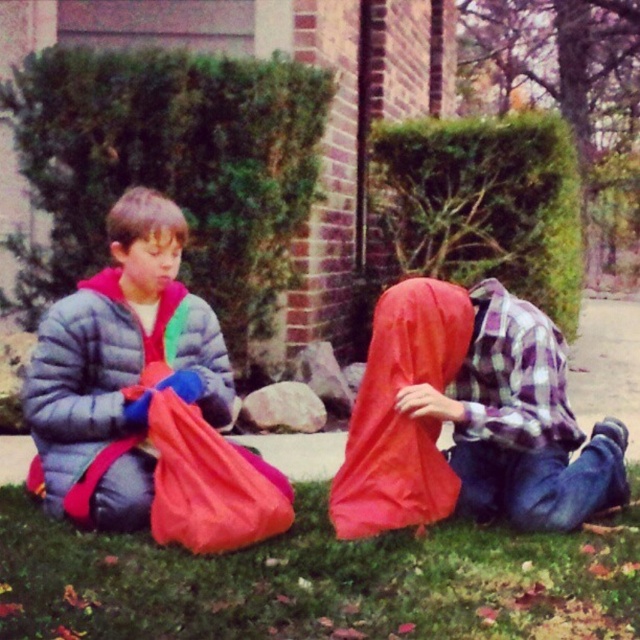
Between matte blue puffer jacket at left and matte red plastic bag at lower left, which one has less height?

Standing shorter between the two is matte red plastic bag at lower left.

Which is behind, point (97, 442) or point (154, 412)?

Positioned behind is point (97, 442).

This screenshot has height=640, width=640. In order to click on matte blue puffer jacket at left in this screenshot , I will do `click(120, 369)`.

This screenshot has width=640, height=640. Describe the element at coordinates (317, 580) in the screenshot. I see `green grass at lower center` at that location.

Which is in front, point (433, 582) or point (440, 355)?

Positioned in front is point (433, 582).

Locate an element on the screen. The width and height of the screenshot is (640, 640). green grass at lower center is located at coordinates (317, 580).

Does green grass at lower center have a lesser width compared to matte blue puffer jacket at left?

No, green grass at lower center is not thinner than matte blue puffer jacket at left.

Which is more to the left, green grass at lower center or matte blue puffer jacket at left?

Positioned to the left is matte blue puffer jacket at left.

Does point (292, 624) come farther from viewer compared to point (106, 346)?

No.

The height and width of the screenshot is (640, 640). I want to click on green grass at lower center, so click(x=317, y=580).